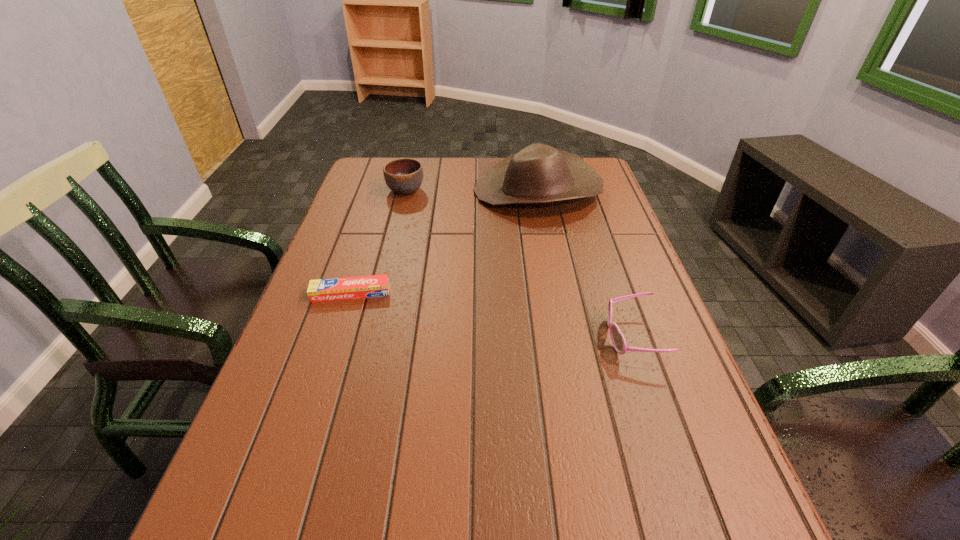
This screenshot has width=960, height=540. Identify the location of the tallest object. (538, 174).

The width and height of the screenshot is (960, 540). In order to click on bowl in this screenshot , I will do `click(403, 176)`.

Find the location of `the nearest object`. the nearest object is located at coordinates (618, 340).

Identify the location of the third tallest object. Image resolution: width=960 pixels, height=540 pixels. (618, 340).

Find the location of a particular element. toothpaste is located at coordinates (344, 288).

Where is `the second nearest object`? This screenshot has width=960, height=540. the second nearest object is located at coordinates (344, 288).

This screenshot has height=540, width=960. I want to click on vacant space located on the left of the tallest object, so click(x=420, y=191).

Where is `vacant space situated on the right of the second tallest object`? This screenshot has width=960, height=540. vacant space situated on the right of the second tallest object is located at coordinates (549, 191).

This screenshot has height=540, width=960. Find the location of `vacant region located on the front-facing side of the nearest object`. vacant region located on the front-facing side of the nearest object is located at coordinates (476, 337).

Find the location of a particular element. This screenshot has width=960, height=540. vacant space located on the front-facing side of the nearest object is located at coordinates (420, 337).